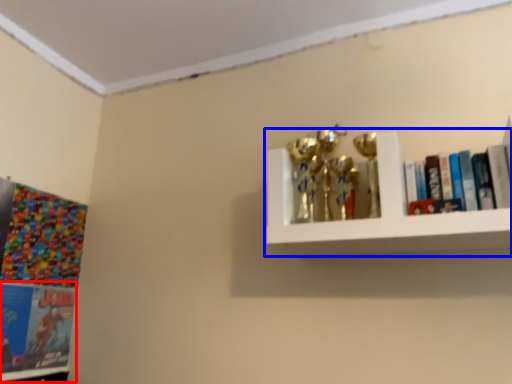
Question: Which object appears closest to the camera in this image, book (highlighted by a red box) or shelf (highlighted by a blue box)?

Choices:
 (A) book
 (B) shelf

Answer: (B)